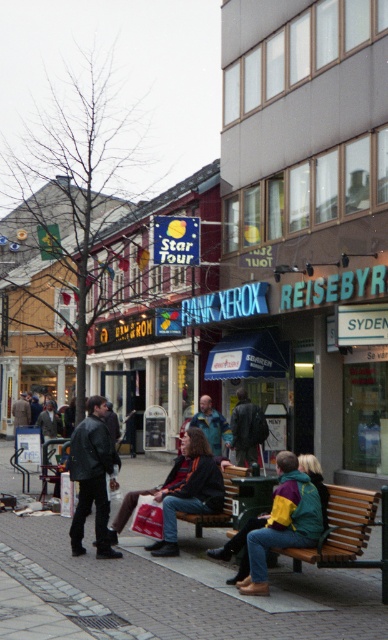
Can you confirm if brown wooden bench at lower center is bigger than dark gray leather jacket at center?

No, brown wooden bench at lower center is not bigger than dark gray leather jacket at center.

Is point (341, 513) closer to viewer compared to point (107, 458)?

That is True.

Where is `brown wooden bench at lower center`? The image size is (388, 640). brown wooden bench at lower center is located at coordinates (348, 532).

Where is `dark brown leather jacket at center`? This screenshot has width=388, height=640. dark brown leather jacket at center is located at coordinates (190, 490).

Consider the image. Is dark brown leather jacket at center positioned in front of green fabric jacket at center?

Yes, it is in front of green fabric jacket at center.

This screenshot has height=640, width=388. Identify the location of dark brown leather jacket at center. (190, 490).

Is dark gray leather jacket at center below green wooden bench at lower center?

Actually, dark gray leather jacket at center is above green wooden bench at lower center.

Between dark gray leather jacket at center and green wooden bench at lower center, which one has less height?

Standing shorter between the two is green wooden bench at lower center.

Which is in front, point (103, 544) or point (209, 524)?

Point (103, 544) is in front.

Find the location of a particular element. This screenshot has width=388, height=640. dark gray leather jacket at center is located at coordinates (91, 476).